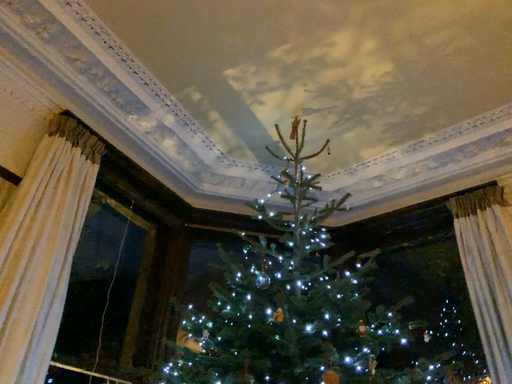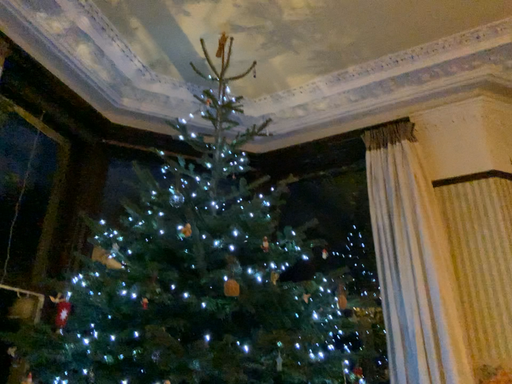
Question: Which way did the camera rotate in the video?

Choices:
 (A) rotated left
 (B) rotated right

Answer: (B)